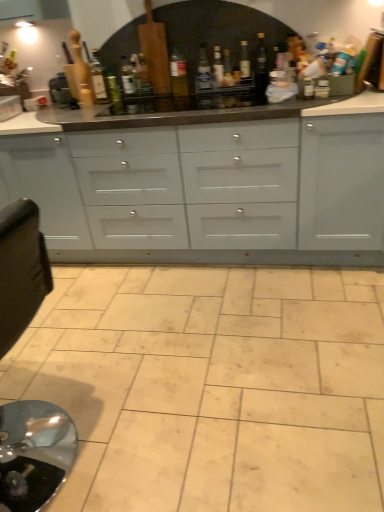
Identify the location of free space on the front side of translucent glass bottle at center, the 3th bottle when ordered from right to left. (224, 98).